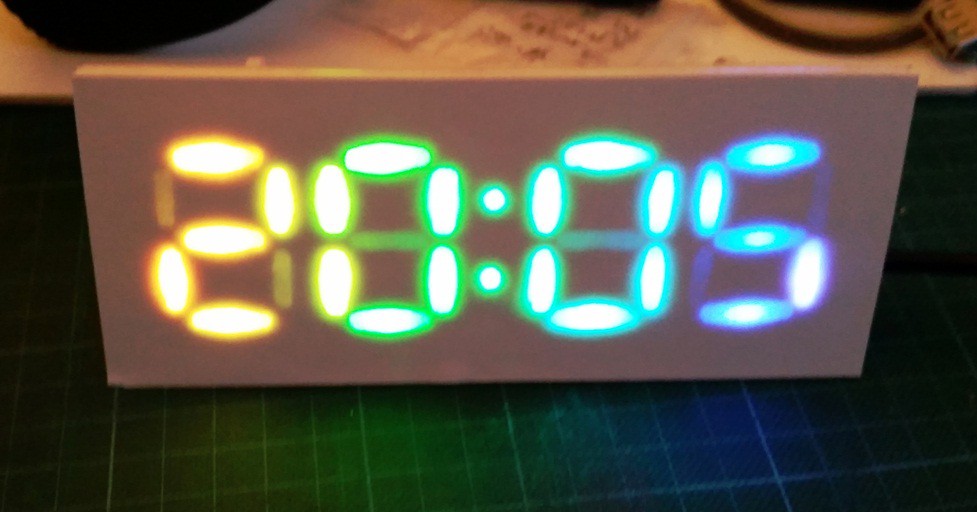
Locate an element on the screen. This screenshot has height=512, width=977. corners of rectangular clock panel is located at coordinates (75, 76), (107, 385), (916, 79), (860, 379).